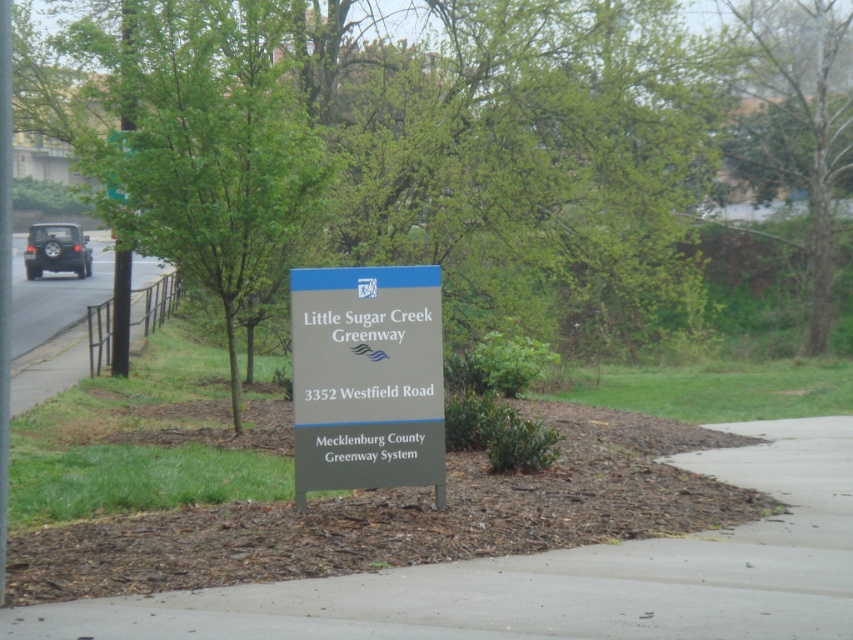
Question: Which object is farther from the camera taking this photo?

Choices:
 (A) black matte suv at left
 (B) metallic gray sign at center
 (C) green leafy tree at upper right

Answer: (A)

Question: Can you confirm if gray concrete pavement at center is thinner than green matte sign at upper center?

Choices:
 (A) no
 (B) yes

Answer: (A)

Question: Can you confirm if gray concrete pavement at center is positioned above green leafy tree at upper right?

Choices:
 (A) yes
 (B) no

Answer: (B)

Question: Which of the following is the farthest from the observer?

Choices:
 (A) (718, 461)
 (B) (119, 184)
 (C) (61, 250)
 (D) (814, 241)

Answer: (C)

Question: Can you confirm if metallic gray sign at center is positioned to the right of green matte sign at upper center?

Choices:
 (A) no
 (B) yes

Answer: (B)

Question: Which point is farther to the camera?

Choices:
 (A) green leafy tree at upper right
 (B) green matte sign at upper center
 (C) metallic gray sign at center
 (D) black matte suv at left

Answer: (D)